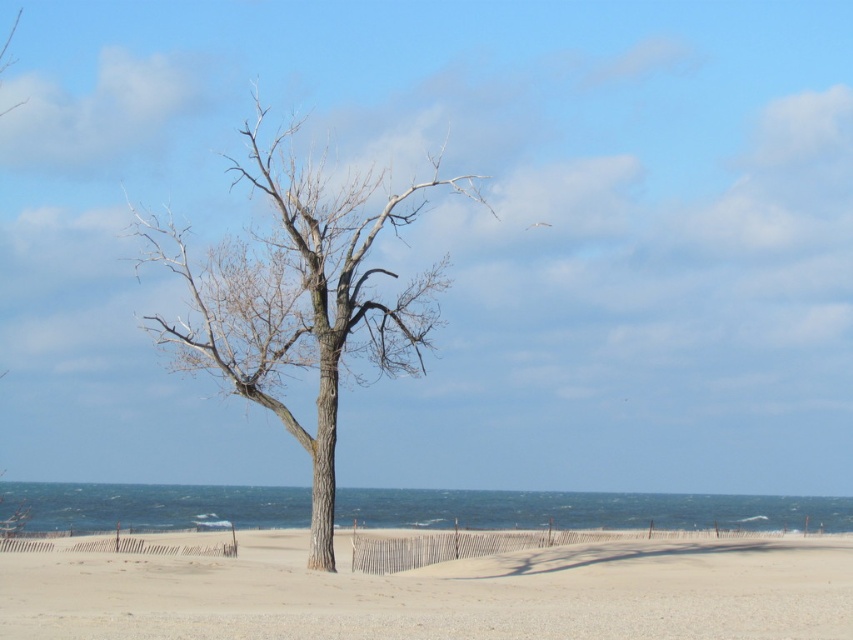
Which of these two, smooth sand at center or bare wood tree at center, stands taller?

With more height is bare wood tree at center.

Is smooth sand at center taller than bare wood tree at center?

No.

Is point (804, 602) more distant than point (401, 349)?

No, (804, 602) is in front of (401, 349).

You are a GUI agent. You are given a task and a screenshot of the screen. Output one action in this format:
    pyautogui.click(x=<x>, y=<y>)
    Task: Click on the smooth sand at center
    This screenshot has height=640, width=853.
    Given the screenshot: What is the action you would take?
    pyautogui.click(x=442, y=593)